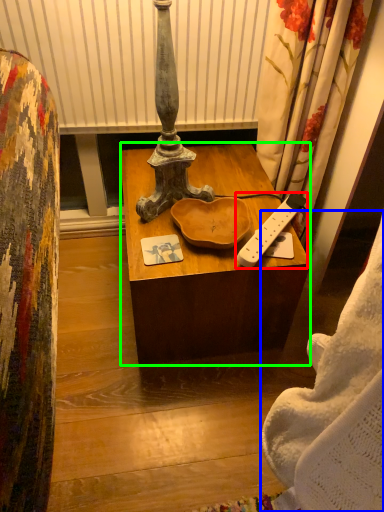
Question: Which object is positioned closest to remote control (highlighted by a red box)? Select from blanket (highlighted by a blue box) and desk (highlighted by a green box).

Choices:
 (A) blanket
 (B) desk

Answer: (B)